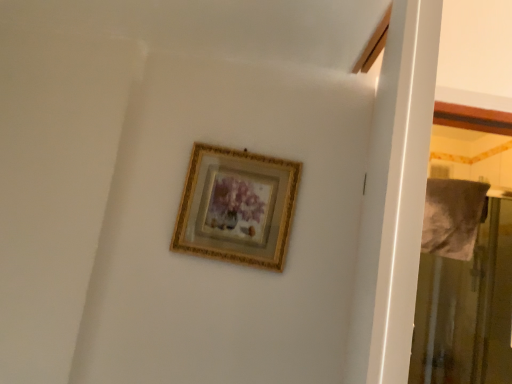
Question: From the image's perspective, is gold/gilded picture frame at upper center on top of transparent plastic screen door at right?

Choices:
 (A) yes
 (B) no

Answer: (A)

Question: Could you tell me if gold/gilded picture frame at upper center is facing transparent plastic screen door at right?

Choices:
 (A) yes
 (B) no

Answer: (B)

Question: Can you confirm if gold/gilded picture frame at upper center is smaller than transparent plastic screen door at right?

Choices:
 (A) no
 (B) yes

Answer: (B)

Question: Can you confirm if gold/gilded picture frame at upper center is thinner than transparent plastic screen door at right?

Choices:
 (A) no
 (B) yes

Answer: (B)

Question: Is the position of gold/gilded picture frame at upper center more distant than that of transparent plastic screen door at right?

Choices:
 (A) yes
 (B) no

Answer: (B)

Question: Does gold/gilded picture frame at upper center have a lesser height compared to transparent plastic screen door at right?

Choices:
 (A) no
 (B) yes

Answer: (B)

Question: Considering the relative sizes of transparent plastic screen door at right and gold/gilded picture frame at upper center in the image provided, is transparent plastic screen door at right shorter than gold/gilded picture frame at upper center?

Choices:
 (A) no
 (B) yes

Answer: (A)

Question: From a real-world perspective, does transparent plastic screen door at right stand above gold/gilded picture frame at upper center?

Choices:
 (A) no
 (B) yes

Answer: (A)

Question: Is transparent plastic screen door at right positioned before gold/gilded picture frame at upper center?

Choices:
 (A) yes
 (B) no

Answer: (B)

Question: Considering the relative sizes of transparent plastic screen door at right and gold/gilded picture frame at upper center in the image provided, is transparent plastic screen door at right smaller than gold/gilded picture frame at upper center?

Choices:
 (A) no
 (B) yes

Answer: (A)

Question: Is transparent plastic screen door at right further to the viewer compared to gold/gilded picture frame at upper center?

Choices:
 (A) no
 (B) yes

Answer: (B)

Question: Is transparent plastic screen door at right at the left side of gold/gilded picture frame at upper center?

Choices:
 (A) no
 (B) yes

Answer: (A)

Question: From the image's perspective, is transparent plastic screen door at right located above or below gold/gilded picture frame at upper center?

Choices:
 (A) below
 (B) above

Answer: (A)